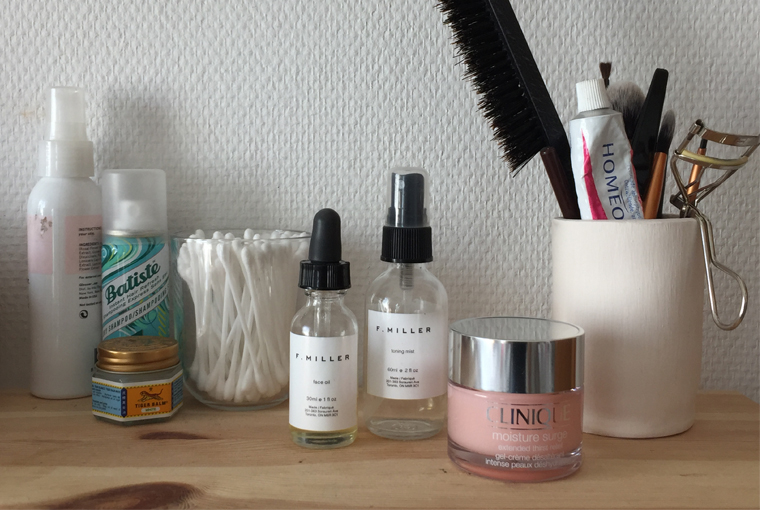
This screenshot has width=760, height=510. Identify the location of makeup brushes. click(622, 100), click(657, 164), click(608, 76).